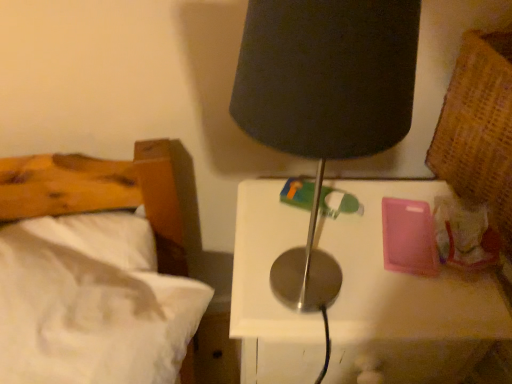
Question: From a real-world perspective, is metallic white nightstand at center physically above white soft bed at left?

Choices:
 (A) no
 (B) yes

Answer: (A)

Question: From a real-world perspective, is metallic white nightstand at center positioned under white soft bed at left based on gravity?

Choices:
 (A) yes
 (B) no

Answer: (A)

Question: From the image's perspective, does metallic white nightstand at center appear lower than white soft bed at left?

Choices:
 (A) yes
 (B) no

Answer: (A)

Question: Is metallic white nightstand at center further to camera compared to white soft bed at left?

Choices:
 (A) no
 (B) yes

Answer: (B)

Question: Is metallic white nightstand at center facing towards white soft bed at left?

Choices:
 (A) yes
 (B) no

Answer: (B)

Question: Considering the positions of point (373, 94) and point (11, 162), is point (373, 94) closer or farther from the camera than point (11, 162)?

Choices:
 (A) closer
 (B) farther

Answer: (A)

Question: Relative to white soft bed at left, is black fabric lamp at upper center in front or behind?

Choices:
 (A) front
 (B) behind

Answer: (A)

Question: In the image, is black fabric lamp at upper center on the left side or the right side of white soft bed at left?

Choices:
 (A) left
 (B) right

Answer: (B)

Question: From the image's perspective, is black fabric lamp at upper center positioned above or below white soft bed at left?

Choices:
 (A) below
 (B) above

Answer: (B)

Question: Which is correct: metallic white nightstand at center is inside white soft bed at left, or outside of it?

Choices:
 (A) inside
 (B) outside

Answer: (B)

Question: Considering their positions, is metallic white nightstand at center located in front of or behind white soft bed at left?

Choices:
 (A) front
 (B) behind

Answer: (B)

Question: From the image's perspective, is metallic white nightstand at center located above or below white soft bed at left?

Choices:
 (A) below
 (B) above

Answer: (A)

Question: In terms of width, does metallic white nightstand at center look wider or thinner when compared to white soft bed at left?

Choices:
 (A) thin
 (B) wide

Answer: (B)

Question: Considering the positions of white soft bed at left and metallic white nightstand at center in the image, is white soft bed at left wider or thinner than metallic white nightstand at center?

Choices:
 (A) wide
 (B) thin

Answer: (B)

Question: Is point (115, 185) closer or farther from the camera than point (404, 352)?

Choices:
 (A) farther
 (B) closer

Answer: (A)